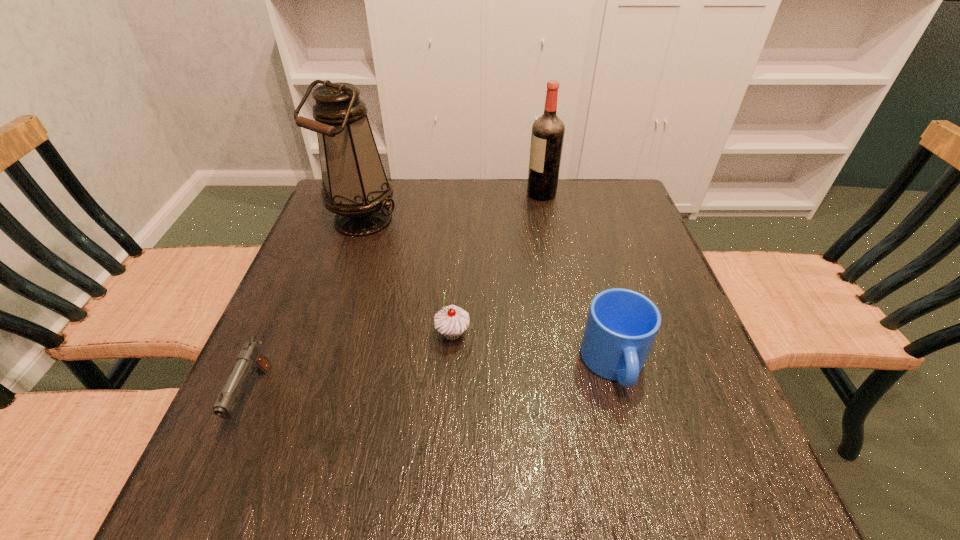
In the image, there is a desktop. Identify the location of vacant space at the left edge. point(281,345).

This screenshot has width=960, height=540. Find the location of `vacant space at the right edge of the desktop`. vacant space at the right edge of the desktop is located at coordinates (743, 446).

Find the location of a particular element. vacant space at the far right corner of the desktop is located at coordinates (634, 220).

Where is `blank space at the near right corner`? blank space at the near right corner is located at coordinates point(679,472).

Where is `free point between the cupcake and the mug`? free point between the cupcake and the mug is located at coordinates (534, 349).

Locate an element on the screen. blank region between the mug and the liquor is located at coordinates (578, 279).

At what (x,y) coordinates should I click in order to perform the action: click on free space between the oil lamp and the mug. Please return your answer as a coordinate pair (x, y). The image size is (960, 540). Looking at the image, I should click on (489, 293).

Where is `free space between the cupcake and the mug`? The height and width of the screenshot is (540, 960). free space between the cupcake and the mug is located at coordinates (534, 349).

The width and height of the screenshot is (960, 540). In order to click on vacant area that lies between the oil lamp and the liquor in this screenshot , I will do `click(452, 207)`.

You are a GUI agent. You are given a task and a screenshot of the screen. Output one action in this format:
    pyautogui.click(x=<x>, y=<y>)
    Task: Click on the blank region between the mug and the third object from left to right
    The width and height of the screenshot is (960, 540).
    Given the screenshot: What is the action you would take?
    pyautogui.click(x=534, y=349)